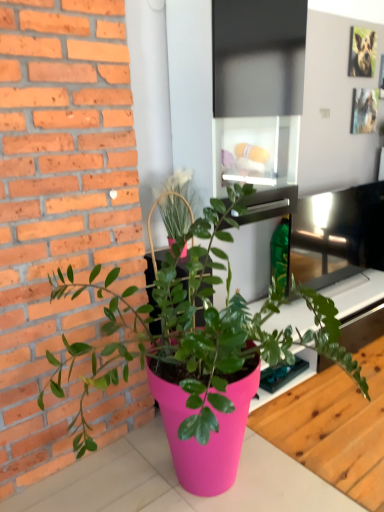
The width and height of the screenshot is (384, 512). I want to click on pink plastic table at lower center, so click(247, 457).

Measure the distance between point (271,499) and camera.

Point (271,499) is 5.57 feet from camera.

What do you see at coordinates (247, 457) in the screenshot? I see `pink plastic table at lower center` at bounding box center [247, 457].

In order to face pink plastic table at lower center, should I rotate leftwards or rightwards?

You should rotate right by 13.056 degrees.

What do you see at coordinates (199, 344) in the screenshot? I see `pink matte pot at center` at bounding box center [199, 344].

I want to click on pink matte pot at center, so click(199, 344).

At what (x,y) coordinates should I click in order to perform the action: click on pink plastic table at lower center. Please return your answer as a coordinate pair (x, y). This screenshot has height=512, width=384. Looking at the image, I should click on (247, 457).

Is pink plastic table at lower center to the left of pink matte pot at center from the viewer's perspective?

No.

Does pink plastic table at lower center lie behind pink matte pot at center?

Yes, pink plastic table at lower center is behind pink matte pot at center.

Which is in front, point (317, 411) or point (127, 347)?

The point (127, 347) is in front.

From the image's perspective, relative to pink matte pot at center, is pink plastic table at lower center above or below?

pink plastic table at lower center is situated lower than pink matte pot at center in the image.

From a real-world perspective, does pink plastic table at lower center stand above pink matte pot at center?

Actually, pink plastic table at lower center is physically below pink matte pot at center in the real world.

Does pink plastic table at lower center have a lesser width compared to pink matte pot at center?

No, pink plastic table at lower center is not thinner than pink matte pot at center.

In the scene shown: Considering the sizes of objects pink plastic table at lower center and pink matte pot at center in the image provided, who is taller, pink plastic table at lower center or pink matte pot at center?

With more height is pink matte pot at center.

Which of these two, pink plastic table at lower center or pink matte pot at center, is smaller?

Smaller between the two is pink plastic table at lower center.

Is pink plastic table at lower center completely or partially outside of pink matte pot at center?

Indeed, pink plastic table at lower center is completely outside pink matte pot at center.

Are pink plastic table at lower center and pink matte pot at center making contact?

No, pink plastic table at lower center is not making contact with pink matte pot at center.

Is pink matte pot at center at the back of pink plastic table at lower center?

Absolutely, pink plastic table at lower center is directed away from pink matte pot at center.

How far apart are pink plastic table at lower center and pink matte pot at center?

21.68 inches.

The width and height of the screenshot is (384, 512). Find the location of `table below the pink matte pot at center (from a real-world perspective)`. table below the pink matte pot at center (from a real-world perspective) is located at coordinates (247, 457).

Is pink matte pot at center to the left or to the right of pink plastic table at lower center in the image?

Based on their positions, pink matte pot at center is located to the left of pink plastic table at lower center.

Looking at this image, is pink matte pot at center positioned behind pink plastic table at lower center?

No, pink matte pot at center is closer to the viewer.

Considering the points (267, 304) and (319, 496), which point is behind, point (267, 304) or point (319, 496)?

Point (267, 304)

From the image's perspective, who appears lower, pink matte pot at center or pink plastic table at lower center?

pink plastic table at lower center.

From a real-world perspective, which is physically above, pink matte pot at center or pink plastic table at lower center?

pink matte pot at center is physically above.

Considering the sizes of objects pink matte pot at center and pink plastic table at lower center in the image provided, who is wider, pink matte pot at center or pink plastic table at lower center?

Wider between the two is pink plastic table at lower center.

Which of these two, pink matte pot at center or pink plastic table at lower center, stands taller?

With more height is pink matte pot at center.

Considering the sizes of objects pink matte pot at center and pink plastic table at lower center in the image provided, who is bigger, pink matte pot at center or pink plastic table at lower center?

pink matte pot at center is bigger.

Is pink matte pot at center spatially inside pink plastic table at lower center, or outside of it?

pink matte pot at center lies outside pink plastic table at lower center.

Is pink matte pot at center far away from pink plastic table at lower center?

Actually, pink matte pot at center and pink plastic table at lower center are a little close together.

Consider the image. Could you tell me if pink matte pot at center is turned towards pink plastic table at lower center?

No, pink matte pot at center is not facing towards pink plastic table at lower center.

Can you tell me how much pink matte pot at center and pink plastic table at lower center differ in facing direction?

The facing directions of pink matte pot at center and pink plastic table at lower center are 180 degrees apart.

How far apart are pink matte pot at center and pink plastic table at lower center?

They are 21.68 inches apart.

Where is `houseplant above the pink plastic table at lower center (from a real-world perspective)`? The height and width of the screenshot is (512, 384). houseplant above the pink plastic table at lower center (from a real-world perspective) is located at coordinates (199, 344).

Where is `houseplant on the left of the pink plastic table at lower center`? The height and width of the screenshot is (512, 384). houseplant on the left of the pink plastic table at lower center is located at coordinates (199, 344).

Find the location of a particular element. table directly beneath the pink matte pot at center (from a real-world perspective) is located at coordinates (247, 457).